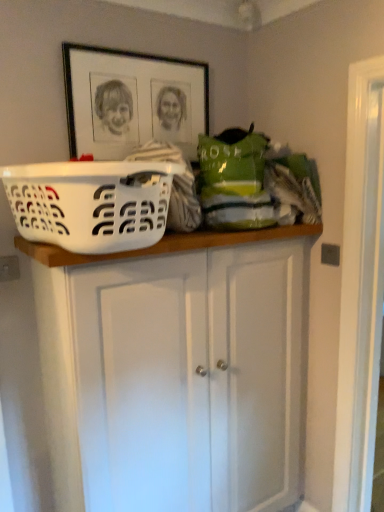
Question: From a real-world perspective, is white plastic laundry basket at upper center over white painted wood cabinet at upper center?

Choices:
 (A) no
 (B) yes

Answer: (B)

Question: Would you say white painted wood cabinet at upper center is part of white plastic laundry basket at upper center's contents?

Choices:
 (A) yes
 (B) no

Answer: (B)

Question: Can you confirm if white plastic laundry basket at upper center is positioned to the left of white painted wood cabinet at upper center?

Choices:
 (A) no
 (B) yes

Answer: (B)

Question: Is white plastic laundry basket at upper center facing towards white painted wood cabinet at upper center?

Choices:
 (A) yes
 (B) no

Answer: (B)

Question: From the image's perspective, is white plastic laundry basket at upper center over white painted wood cabinet at upper center?

Choices:
 (A) yes
 (B) no

Answer: (A)

Question: Is black matte picture frame at upper center in front of or behind white painted wood cabinet at upper center in the image?

Choices:
 (A) behind
 (B) front

Answer: (A)

Question: From their relative heights in the image, would you say black matte picture frame at upper center is taller or shorter than white painted wood cabinet at upper center?

Choices:
 (A) short
 (B) tall

Answer: (A)

Question: Based on their positions, is black matte picture frame at upper center located to the left or right of white painted wood cabinet at upper center?

Choices:
 (A) left
 (B) right

Answer: (A)

Question: From a real-world perspective, is black matte picture frame at upper center physically located above or below white painted wood cabinet at upper center?

Choices:
 (A) above
 (B) below

Answer: (A)

Question: Is point (158, 226) closer or farther from the camera than point (253, 389)?

Choices:
 (A) closer
 (B) farther

Answer: (A)

Question: Is white plastic laundry basket at upper center inside or outside of white painted wood cabinet at upper center?

Choices:
 (A) inside
 (B) outside

Answer: (B)

Question: In the image, is white plastic laundry basket at upper center on the left side or the right side of white painted wood cabinet at upper center?

Choices:
 (A) right
 (B) left

Answer: (B)

Question: Considering their positions, is white plastic laundry basket at upper center located in front of or behind white painted wood cabinet at upper center?

Choices:
 (A) behind
 (B) front

Answer: (B)

Question: Is white painted wood cabinet at upper center wider or thinner than black matte picture frame at upper center?

Choices:
 (A) wide
 (B) thin

Answer: (A)

Question: Do you think white painted wood cabinet at upper center is within black matte picture frame at upper center, or outside of it?

Choices:
 (A) inside
 (B) outside

Answer: (B)